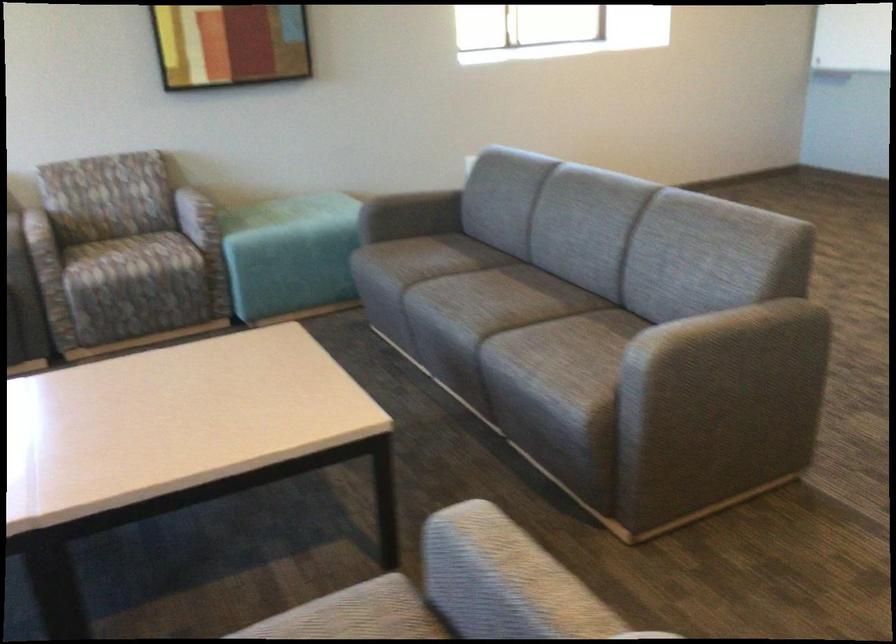
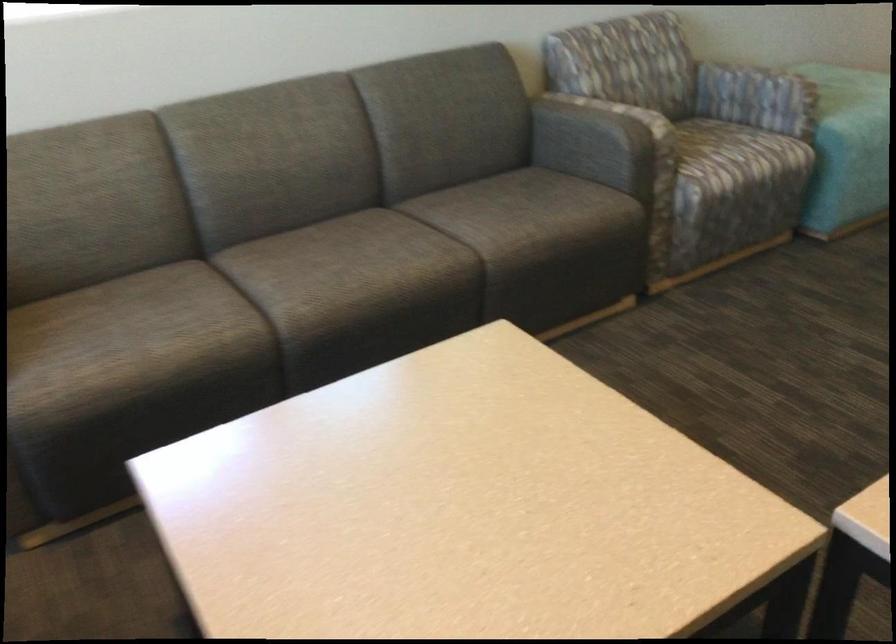
Find the pixel in the second image that matches (141,265) in the first image.

(737, 155)